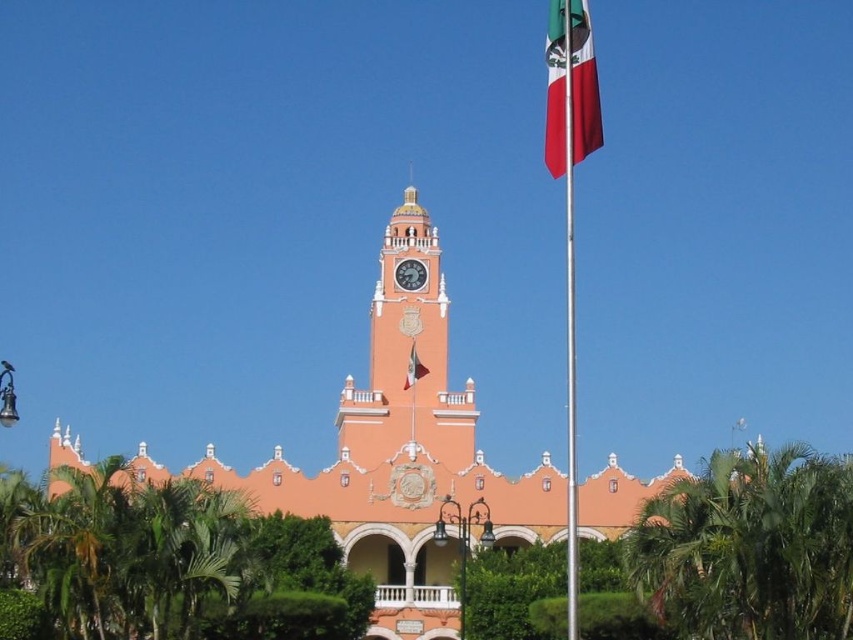
You are standing at point (399, 456) in the image. Based on the scene, what structure is located at your current position?

The orange stucco church at center is located at point (399, 456).

You are standing in front of the building and want to take a photo of the pink stucco clock tower at center without the silky fabric flag at center appearing in the shot. Is this possible given their positions?

The pink stucco clock tower at center is positioned under the silky fabric flag at center, so the flag will block the view of the tower. Therefore, it is not possible to take a photo of the pink stucco clock tower at center without the silky fabric flag at center appearing in the shot.

Based on the photo, you are a photographer trying to capture the orange stucco church at center and the red fabric flag at upper right in the same frame. Based on their sizes in the image, which object would appear larger in your photo?

The orange stucco church at center is much taller than the red fabric flag at upper right, so it would appear larger in the photo.